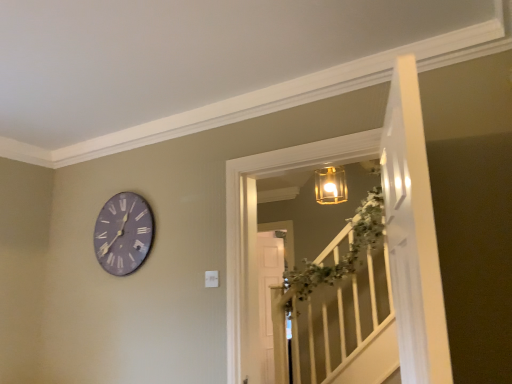
Question: Are white glossy door at upper right and purple matte clock at upper left located far from each other?

Choices:
 (A) yes
 (B) no

Answer: (A)

Question: Considering the relative sizes of white glossy door at upper right and purple matte clock at upper left in the image provided, is white glossy door at upper right taller than purple matte clock at upper left?

Choices:
 (A) no
 (B) yes

Answer: (B)

Question: Is white glossy door at upper right oriented away from purple matte clock at upper left?

Choices:
 (A) no
 (B) yes

Answer: (A)

Question: From a real-world perspective, is white glossy door at upper right beneath purple matte clock at upper left?

Choices:
 (A) no
 (B) yes

Answer: (B)

Question: Is the depth of white glossy door at upper right less than that of purple matte clock at upper left?

Choices:
 (A) yes
 (B) no

Answer: (A)

Question: Is white glossy door at upper right bigger than purple matte clock at upper left?

Choices:
 (A) yes
 (B) no

Answer: (A)

Question: Is white glossy door at upper right in contact with translucent glass lantern at upper center?

Choices:
 (A) yes
 (B) no

Answer: (B)

Question: From the image's perspective, is white glossy door at upper right under translucent glass lantern at upper center?

Choices:
 (A) yes
 (B) no

Answer: (B)

Question: Is white glossy door at upper right closer to the viewer compared to translucent glass lantern at upper center?

Choices:
 (A) yes
 (B) no

Answer: (A)

Question: Does white glossy door at upper right appear on the right side of translucent glass lantern at upper center?

Choices:
 (A) no
 (B) yes

Answer: (B)

Question: Is white glossy door at upper right far away from translucent glass lantern at upper center?

Choices:
 (A) no
 (B) yes

Answer: (B)

Question: Is translucent glass lantern at upper center located within white glossy door at upper right?

Choices:
 (A) no
 (B) yes

Answer: (A)

Question: From the image's perspective, would you say translucent glass lantern at upper center is shown under purple matte clock at upper left?

Choices:
 (A) no
 (B) yes

Answer: (B)